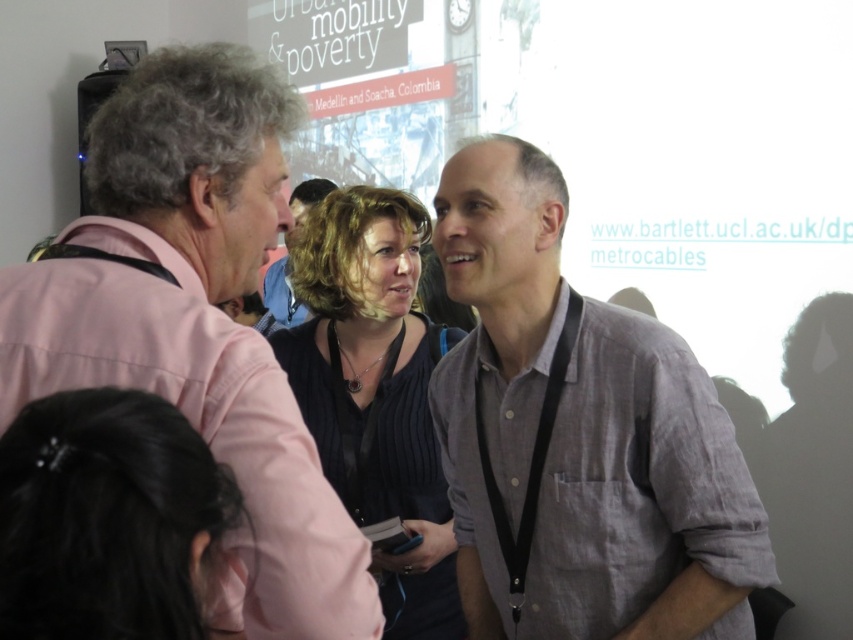
Who is taller, gray linen shirt at center or black hair at lower left?

With more height is gray linen shirt at center.

Who is lower down, gray linen shirt at center or black hair at lower left?

Positioned lower is black hair at lower left.

Does point (705, 376) lie in front of point (102, 454)?

No, (705, 376) is further to viewer.

This screenshot has height=640, width=853. Find the location of `gray linen shirt at center`. gray linen shirt at center is located at coordinates (579, 436).

Who is higher up, black hair at lower left or dark brown hair at center?

dark brown hair at center is higher up.

Can you confirm if black hair at lower left is bigger than dark brown hair at center?

Actually, black hair at lower left might be smaller than dark brown hair at center.

This screenshot has height=640, width=853. Find the location of `black hair at lower left`. black hair at lower left is located at coordinates (106, 516).

Which is in front, point (228, 547) or point (299, 205)?

Point (228, 547)

Image resolution: width=853 pixels, height=640 pixels. What do you see at coordinates (196, 323) in the screenshot?
I see `pink cotton shirt at left` at bounding box center [196, 323].

In order to click on pink cotton shirt at left in this screenshot , I will do `click(196, 323)`.